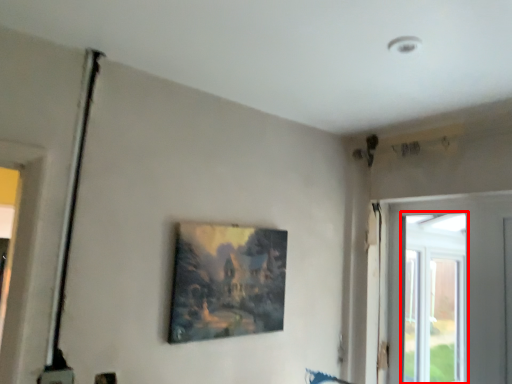
Question: In this image, where is window (annotated by the red box) located relative to picture frame?

Choices:
 (A) left
 (B) right

Answer: (B)